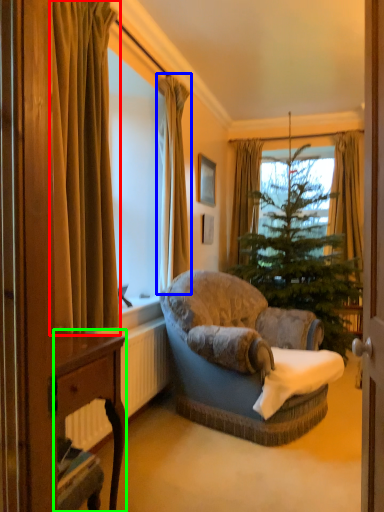
Question: Based on their relative distances, which object is nearer to curtain (highlighted by a red box)? Choose from curtain (highlighted by a blue box) and desk (highlighted by a green box).

Choices:
 (A) curtain
 (B) desk

Answer: (B)